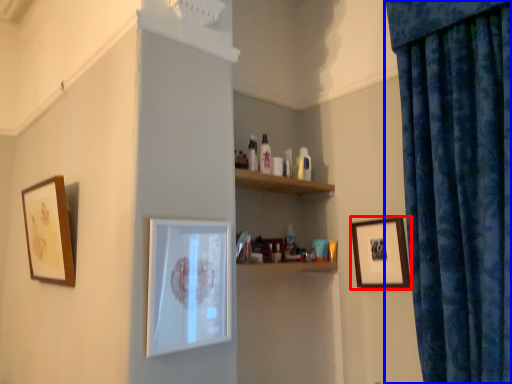
Question: Among these objects, which one is nearest to the camera, picture frame (highlighted by a red box) or curtain (highlighted by a blue box)?

Choices:
 (A) picture frame
 (B) curtain

Answer: (B)